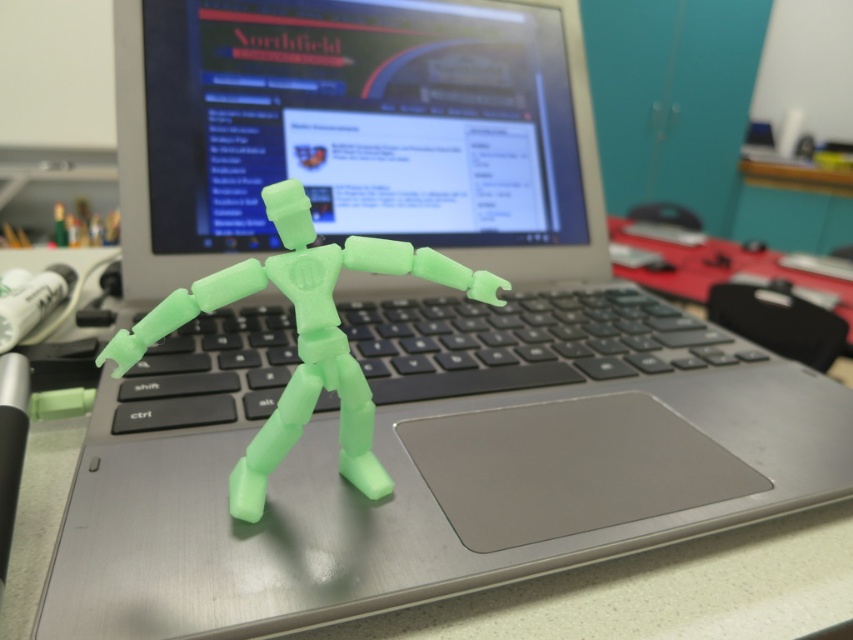
Is black plastic keyboard at center above translucent green plastic figure at center?

Correct, black plastic keyboard at center is located above translucent green plastic figure at center.

Does point (375, 365) lie behind point (350, 452)?

Yes, it is behind point (350, 452).

Locate an element on the screen. Image resolution: width=853 pixels, height=640 pixels. black plastic keyboard at center is located at coordinates (525, 342).

Is point (553, 195) positioned in front of point (308, 257)?

No, it is behind (308, 257).

Who is shorter, matte plastic monitor at center or translucent green plastic figure at center?

With less height is translucent green plastic figure at center.

Does point (498, 120) come closer to viewer compared to point (407, 253)?

That is False.

Locate an element on the screen. Image resolution: width=853 pixels, height=640 pixels. matte plastic monitor at center is located at coordinates (355, 131).

Which is in front, point (193, 160) or point (166, 417)?

Positioned in front is point (166, 417).

Does matte plastic monitor at center appear under black plastic keyboard at center?

Actually, matte plastic monitor at center is above black plastic keyboard at center.

Describe the element at coordinates (355, 131) in the screenshot. The width and height of the screenshot is (853, 640). I see `matte plastic monitor at center` at that location.

Identify the location of matte plastic monitor at center. This screenshot has width=853, height=640. (355, 131).